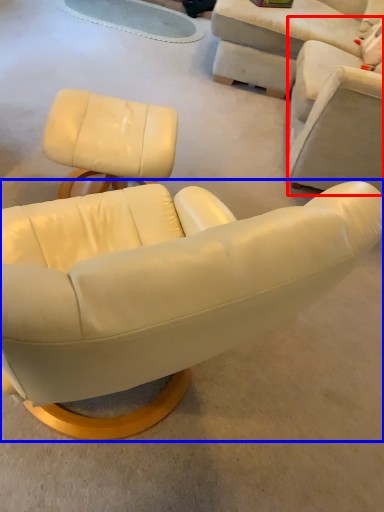
Question: Which object is further to the camera taking this photo, chair (highlighted by a red box) or chair (highlighted by a blue box)?

Choices:
 (A) chair
 (B) chair

Answer: (A)